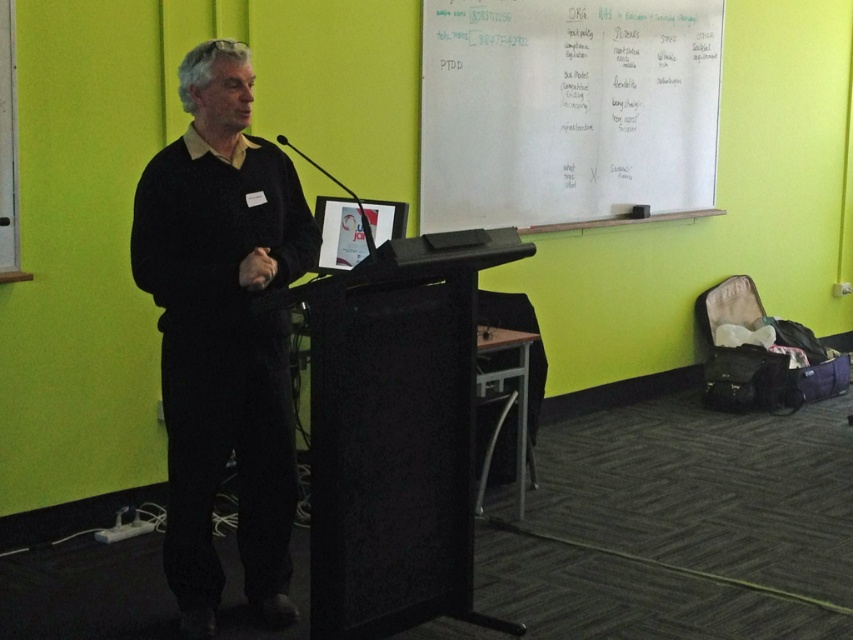
You are an attendee at this event and need to take a photo of the presenter. Since the black matte sweater at left is smaller than the whiteboard at upper center, which object should you focus on to ensure the presenter is clearly visible in the photo?

The black matte sweater at left is smaller than the whiteboard at upper center, so focusing on the presenter wearing the black matte sweater at left will ensure they are clearly visible in the photo.

You are a photographer standing at the back of the room. You want to take a photo of the black matte sweater at left and the black matte podium at center so that both are clearly visible in the frame. Given that your camera has a minimum focus distance of 20 inches, will you be able to focus on both objects simultaneously?

The black matte sweater at left and black matte podium at center are 20.68 inches apart from each other. Since the distance between them is greater than the camera minimum focus distance of 20 inches, the photographer can focus on both objects simultaneously.

You are an event planner setting up for a presentation. You need to know if the whiteboard at upper center can accommodate a large banner that requires more width than the black matte podium at center. Can you determine this based on the available information?

The whiteboard at upper center might be wider than the black matte podium at center, so it could potentially accommodate the banner if the banner requires more width than the podium.